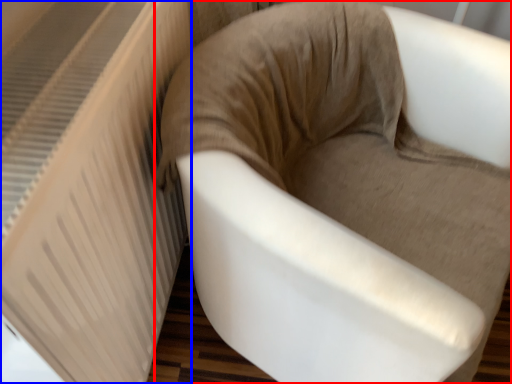
Question: Which object is closer to the camera taking this photo, chair (highlighted by a red box) or radiator (highlighted by a blue box)?

Choices:
 (A) chair
 (B) radiator

Answer: (B)